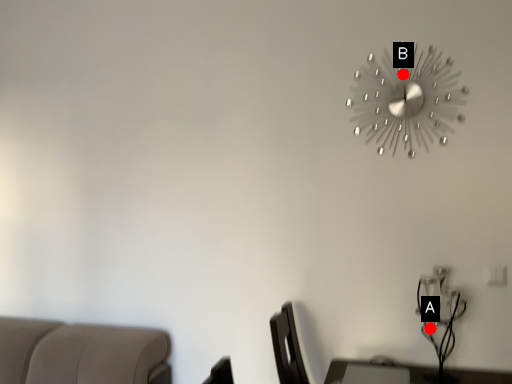
Question: Two points are circled on the image, labeled by A and B beside each circle. Which of the following is the farthest from the observer?

Choices:
 (A) A is further
 (B) B is further

Answer: (B)